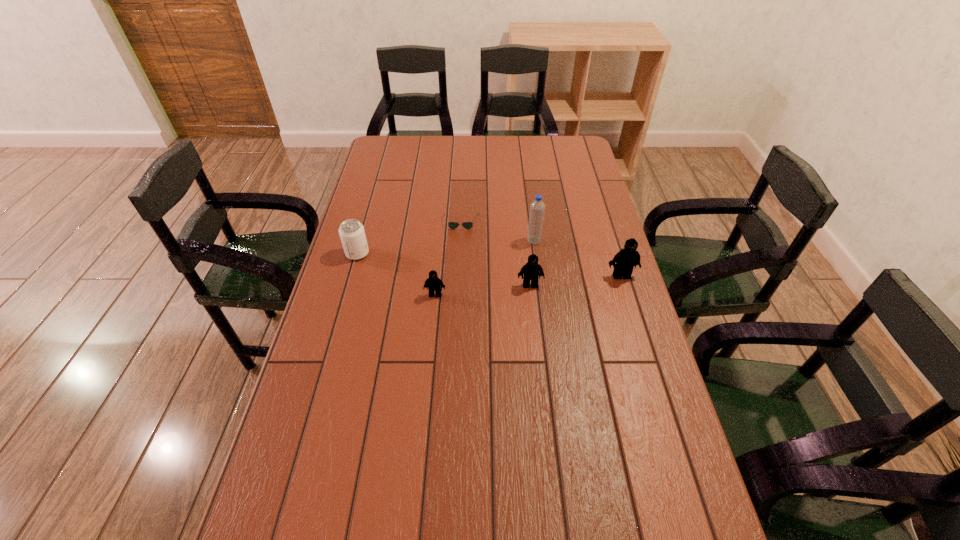
Identify the location of free space between the soda can and the water bottle. (445, 247).

The height and width of the screenshot is (540, 960). Find the location of `vacant space that's between the second Lego from left to right and the leftmost object`. vacant space that's between the second Lego from left to right and the leftmost object is located at coordinates (444, 269).

Where is `vacant area that lies between the leftmost Lego and the second farthest object`? vacant area that lies between the leftmost Lego and the second farthest object is located at coordinates pyautogui.click(x=485, y=268).

The width and height of the screenshot is (960, 540). Find the location of `blank region between the second shortest object and the water bottle`. blank region between the second shortest object and the water bottle is located at coordinates (485, 268).

The image size is (960, 540). Find the location of `free point between the third nearest object and the shortest object`. free point between the third nearest object and the shortest object is located at coordinates (541, 249).

The image size is (960, 540). In order to click on object that is the third closest to the tallest object in this screenshot , I will do `click(624, 261)`.

Select which object appears as the second closest to the third farthest object. Please provide its 2D coordinates. Your answer should be formatted as a tuple, i.e. [(x, y)], where the tuple contains the x and y coordinates of a point satisfying the conditions above.

[(452, 225)]

You are a GUI agent. You are given a task and a screenshot of the screen. Output one action in this format:
    pyautogui.click(x=<x>, y=<y>)
    Task: Click on the Lego that is the second closest to the second shortest object
    
    Given the screenshot: What is the action you would take?
    [x=624, y=261]

The height and width of the screenshot is (540, 960). Identify the location of the third closest Lego to the tallest object. (433, 283).

Find the location of a particular element. This screenshot has width=960, height=540. vacant space that satisfies the following two spatial constraints: 1. on the lenses of the tallest object; 2. on the left side of the shortest object is located at coordinates (460, 241).